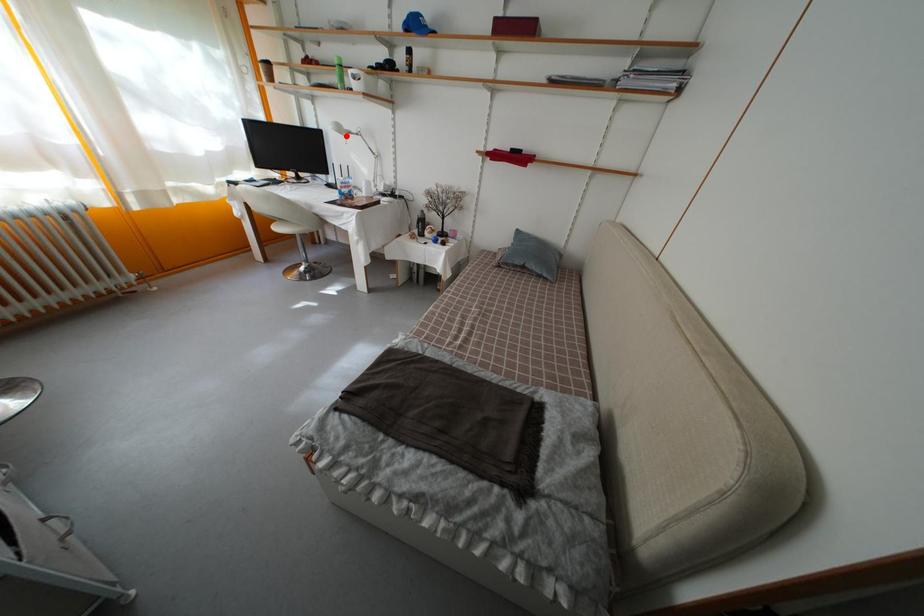
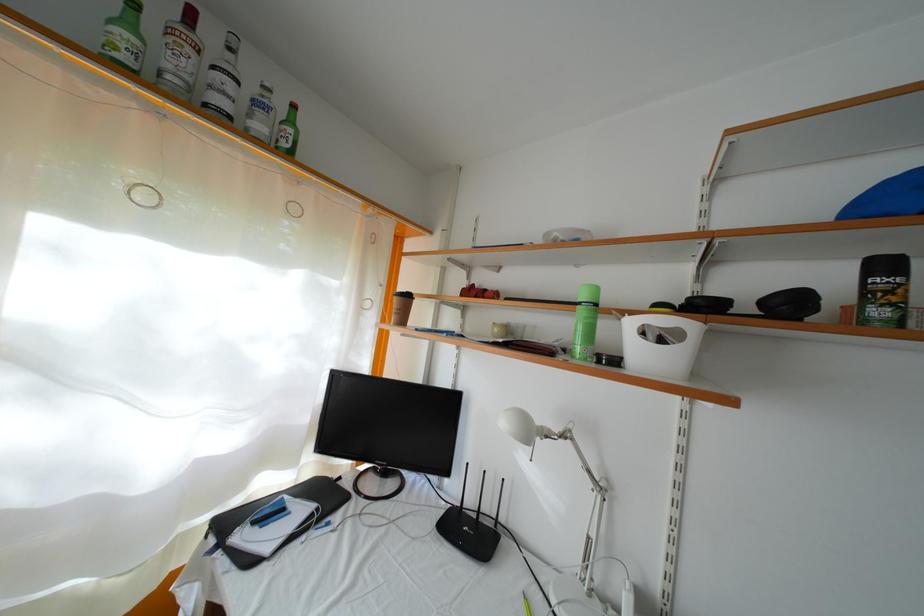
In the second image, find the point that corresponds to the highlighted location in the first image.

(535, 439)